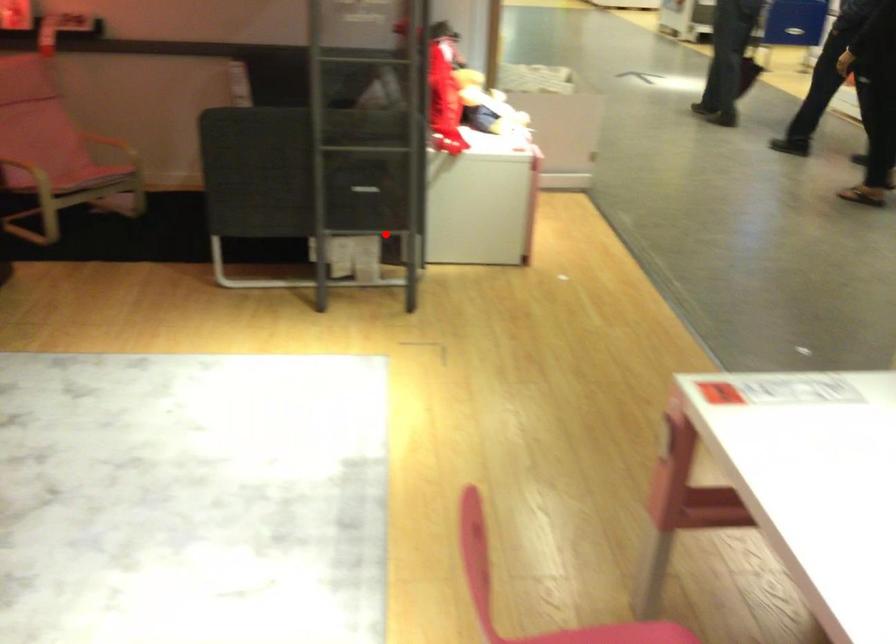
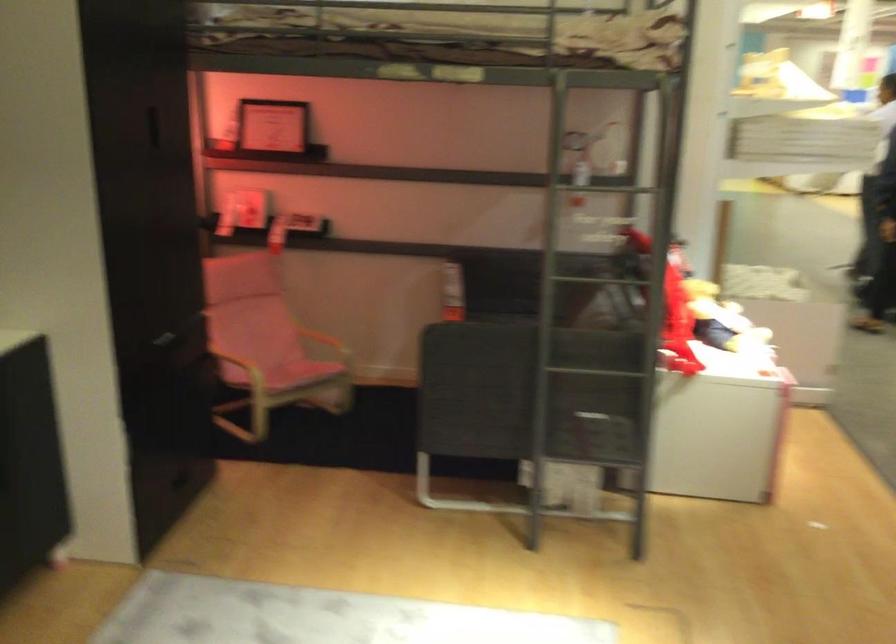
Question: I am providing you with two images of the same scene from different viewpoints. Image1 has a red point marked. In image2, the corresponding 3D location appears at what relative position? Reply with the corresponding letter.

Choices:
 (A) Closer
 (B) Farther

Answer: (A)